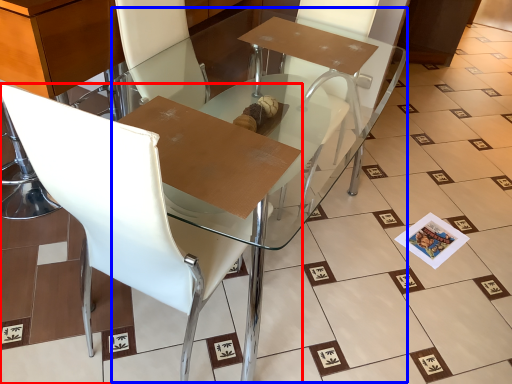
Question: Which object is further to the camera taking this photo, chair (highlighted by a red box) or round table (highlighted by a blue box)?

Choices:
 (A) chair
 (B) round table

Answer: (B)